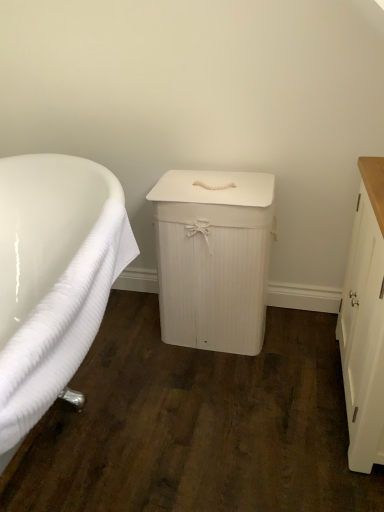
This screenshot has height=512, width=384. What do you see at coordinates (53, 278) in the screenshot?
I see `white ribbed towel at left` at bounding box center [53, 278].

I want to click on white wood cabinet at right, which is the first cabinetry in right-to-left order, so click(x=365, y=322).

This screenshot has height=512, width=384. I want to click on white wood laundry bin at center, which is the 2th cabinetry from right to left, so click(213, 258).

Are white ribbed towel at left and white wood cabinet at right, marked as the 2th cabinetry in a left-to-right arrangement, far apart?

white ribbed towel at left is near white wood cabinet at right, marked as the 2th cabinetry in a left-to-right arrangement, not far away.

Considering the relative positions of white ribbed towel at left and white wood cabinet at right, marked as the 2th cabinetry in a left-to-right arrangement, in the image provided, is white ribbed towel at left to the left or to the right of white wood cabinet at right, marked as the 2th cabinetry in a left-to-right arrangement,?

Clearly, white ribbed towel at left is on the left of white wood cabinet at right, marked as the 2th cabinetry in a left-to-right arrangement, in the image.

In the scene shown: Does white ribbed towel at left have a lesser width compared to white wood cabinet at right, marked as the 2th cabinetry in a left-to-right arrangement?

Incorrect, the width of white ribbed towel at left is not less than that of white wood cabinet at right, marked as the 2th cabinetry in a left-to-right arrangement.

Which object is wider, white wood laundry bin at center, which is the 2th cabinetry from right to left, or white ribbed towel at left?

white ribbed towel at left.

How different are the orientations of white wood laundry bin at center, which ranks as the 1th cabinetry in left-to-right order, and white ribbed towel at left in degrees?

There is a 89.9-degree angle between the facing directions of white wood laundry bin at center, which ranks as the 1th cabinetry in left-to-right order, and white ribbed towel at left.

From the image's perspective, which is above, white wood laundry bin at center, which is the 2th cabinetry from right to left, or white ribbed towel at left?

white wood laundry bin at center, which is the 2th cabinetry from right to left, from the image's perspective.

Does white wood laundry bin at center, which ranks as the 1th cabinetry in left-to-right order, come behind white ribbed towel at left?

Yes, white wood laundry bin at center, which ranks as the 1th cabinetry in left-to-right order, is behind white ribbed towel at left.

From the image's perspective, is white wood cabinet at right, which is the first cabinetry in right-to-left order, above or below white ribbed towel at left?

From the image's perspective, white wood cabinet at right, which is the first cabinetry in right-to-left order, appears above white ribbed towel at left.

Which is in front, white wood cabinet at right, marked as the 2th cabinetry in a left-to-right arrangement, or white ribbed towel at left?

white ribbed towel at left is more forward.

Choose the correct answer: Is white wood cabinet at right, which is the first cabinetry in right-to-left order, inside white ribbed towel at left or outside it?

white wood cabinet at right, which is the first cabinetry in right-to-left order, is not enclosed by white ribbed towel at left.

Are white wood cabinet at right, marked as the 2th cabinetry in a left-to-right arrangement, and white ribbed towel at left making contact?

No.

Does white ribbed towel at left appear on the left side of white wood laundry bin at center, which ranks as the 1th cabinetry in left-to-right order?

Yes.

From the image's perspective, is white ribbed towel at left located above or below white wood laundry bin at center, which ranks as the 1th cabinetry in left-to-right order?

Clearly, from the image's perspective, white ribbed towel at left is below white wood laundry bin at center, which ranks as the 1th cabinetry in left-to-right order.

Is white ribbed towel at left placed right next to white wood laundry bin at center, which ranks as the 1th cabinetry in left-to-right order?

No, white ribbed towel at left is not in contact with white wood laundry bin at center, which ranks as the 1th cabinetry in left-to-right order.

In the scene shown: Is white ribbed towel at left looking in the opposite direction of white wood laundry bin at center, which ranks as the 1th cabinetry in left-to-right order?

That's not correct — white ribbed towel at left is not looking away from white wood laundry bin at center, which ranks as the 1th cabinetry in left-to-right order.

Is white wood cabinet at right, which is the first cabinetry in right-to-left order, oriented away from white wood laundry bin at center, which is the 2th cabinetry from right to left?

That's not correct — white wood cabinet at right, which is the first cabinetry in right-to-left order, is not looking away from white wood laundry bin at center, which is the 2th cabinetry from right to left.

Between white wood cabinet at right, which is the first cabinetry in right-to-left order, and white wood laundry bin at center, which is the 2th cabinetry from right to left, which one appears on the left side from the viewer's perspective?

Positioned to the left is white wood laundry bin at center, which is the 2th cabinetry from right to left.

Is white wood cabinet at right, which is the first cabinetry in right-to-left order, located outside white wood laundry bin at center, which ranks as the 1th cabinetry in left-to-right order?

Yes.

Considering the sizes of objects white wood cabinet at right, marked as the 2th cabinetry in a left-to-right arrangement, and white wood laundry bin at center, which ranks as the 1th cabinetry in left-to-right order, in the image provided, who is thinner, white wood cabinet at right, marked as the 2th cabinetry in a left-to-right arrangement, or white wood laundry bin at center, which ranks as the 1th cabinetry in left-to-right order,?

white wood cabinet at right, marked as the 2th cabinetry in a left-to-right arrangement, is thinner.

From the image's perspective, is white wood laundry bin at center, which ranks as the 1th cabinetry in left-to-right order, on top of white wood cabinet at right, marked as the 2th cabinetry in a left-to-right arrangement?

Yes, from the image's perspective, white wood laundry bin at center, which ranks as the 1th cabinetry in left-to-right order, is over white wood cabinet at right, marked as the 2th cabinetry in a left-to-right arrangement.

Which point is more forward, (262,294) or (361,178)?

Positioned in front is point (361,178).

Is white wood laundry bin at center, which is the 2th cabinetry from right to left, positioned far away from white wood cabinet at right, which is the first cabinetry in right-to-left order?

No, there isn't a large distance between white wood laundry bin at center, which is the 2th cabinetry from right to left, and white wood cabinet at right, which is the first cabinetry in right-to-left order.

Is white wood laundry bin at center, which ranks as the 1th cabinetry in left-to-right order, positioned behind white wood cabinet at right, which is the first cabinetry in right-to-left order?

Yes, it is.

Find the location of `the 1st cabinetry above the white ribbed towel at left (from the image's perspective)`. the 1st cabinetry above the white ribbed towel at left (from the image's perspective) is located at coordinates (365, 322).

I want to click on bathtub below the white wood laundry bin at center, which ranks as the 1th cabinetry in left-to-right order (from the image's perspective), so click(x=53, y=278).

Based on their spatial positions, is white ribbed towel at left or white wood laundry bin at center, which ranks as the 1th cabinetry in left-to-right order, closer to white wood cabinet at right, marked as the 2th cabinetry in a left-to-right arrangement?

white wood laundry bin at center, which ranks as the 1th cabinetry in left-to-right order.

Which object lies nearer to the anchor point white wood laundry bin at center, which ranks as the 1th cabinetry in left-to-right order, white ribbed towel at left or white wood cabinet at right, marked as the 2th cabinetry in a left-to-right arrangement?

white ribbed towel at left.

Which object lies further to the anchor point white ribbed towel at left, white wood cabinet at right, marked as the 2th cabinetry in a left-to-right arrangement, or white wood laundry bin at center, which ranks as the 1th cabinetry in left-to-right order?

white wood cabinet at right, marked as the 2th cabinetry in a left-to-right arrangement, lies further to white ribbed towel at left than the other object.

Which object lies further to the anchor point white wood cabinet at right, marked as the 2th cabinetry in a left-to-right arrangement, white wood laundry bin at center, which is the 2th cabinetry from right to left, or white ribbed towel at left?

Based on the image, white ribbed towel at left appears to be further to white wood cabinet at right, marked as the 2th cabinetry in a left-to-right arrangement.

When comparing their distances from white wood laundry bin at center, which is the 2th cabinetry from right to left, does white wood cabinet at right, which is the first cabinetry in right-to-left order, or white ribbed towel at left seem closer?

white ribbed towel at left.

From the image, which object appears to be farther from white ribbed towel at left, white wood laundry bin at center, which ranks as the 1th cabinetry in left-to-right order, or white wood cabinet at right, which is the first cabinetry in right-to-left order?

white wood cabinet at right, which is the first cabinetry in right-to-left order, lies further to white ribbed towel at left than the other object.

In order to click on cabinetry between white ribbed towel at left and white wood cabinet at right, which is the first cabinetry in right-to-left order in this screenshot , I will do `click(213, 258)`.